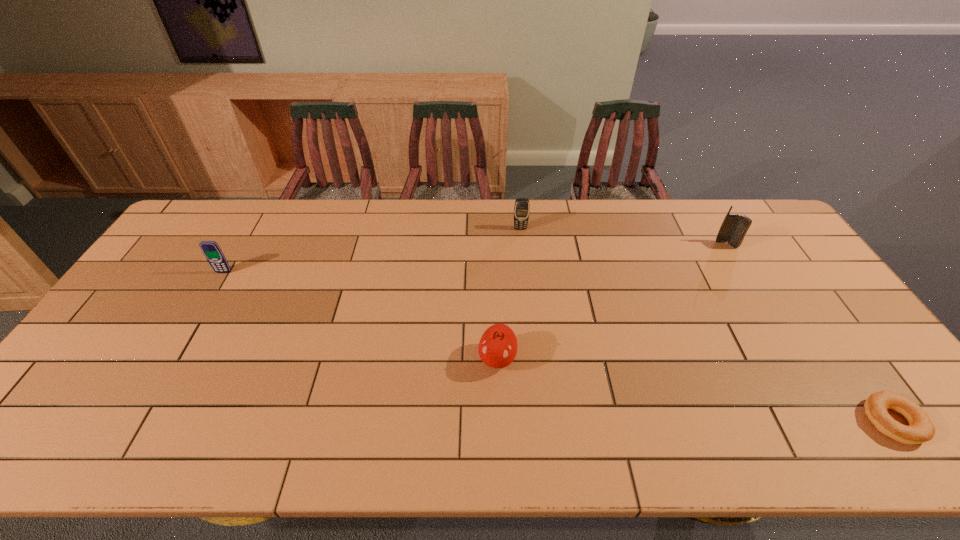
Identify the location of free region located 0.270m on the keyboard of the rightmost cellular telephone. Image resolution: width=960 pixels, height=540 pixels. (767, 313).

Find the location of a particular element. The width and height of the screenshot is (960, 540). vacant space situated 0.230m on the front-facing side of the leftmost cellular telephone is located at coordinates (188, 333).

The width and height of the screenshot is (960, 540). Identify the location of vacant space situated 0.140m on the front face of the second cellular telephone from left to right. (523, 258).

At what (x,y) coordinates should I click in order to perform the action: click on free space located on the left of the apple. Please return your answer as a coordinate pair (x, y). The width and height of the screenshot is (960, 540). Looking at the image, I should click on (444, 359).

Find the location of a particular element. This screenshot has width=960, height=540. free space located on the back of the shortest object is located at coordinates (797, 286).

Where is `object situated at the near edge`? This screenshot has width=960, height=540. object situated at the near edge is located at coordinates 921,429.

Where is `object present at the right edge`? This screenshot has width=960, height=540. object present at the right edge is located at coordinates 921,429.

At what (x,y) coordinates should I click in order to perform the action: click on object present at the near right corner. Please return your answer as a coordinate pair (x, y). Image resolution: width=960 pixels, height=540 pixels. Looking at the image, I should click on (921, 429).

In the image, there is a desktop. Where is `free space at the far edge`? The height and width of the screenshot is (540, 960). free space at the far edge is located at coordinates (491, 205).

You are a GUI agent. You are given a task and a screenshot of the screen. Output one action in this format:
    pyautogui.click(x=<x>, y=<y>)
    Task: Click on the vacant space at the near edge of the desktop
    
    Given the screenshot: What is the action you would take?
    pyautogui.click(x=140, y=442)